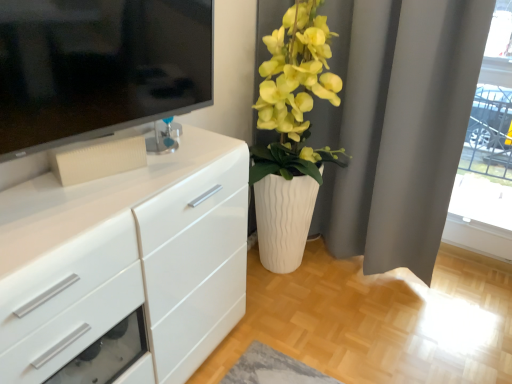
You are a GUI agent. You are given a task and a screenshot of the screen. Output one action in this format:
    pyautogui.click(x=<x>, y=<y>)
    Task: Click on the free space in front of matte white vase at center right
    
    Given the screenshot: What is the action you would take?
    pyautogui.click(x=303, y=333)